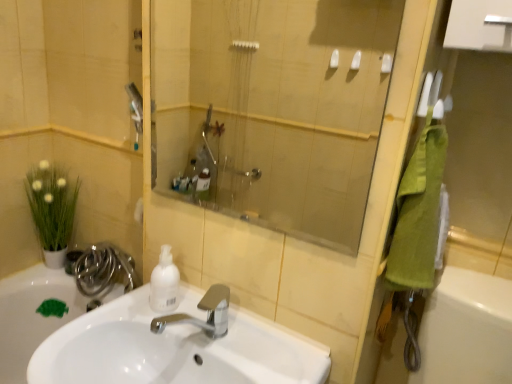
Question: Does transparent glass shower at center have a smaller size compared to white matte bottle at center?

Choices:
 (A) no
 (B) yes

Answer: (A)

Question: Does transparent glass shower at center have a greater width compared to white matte bottle at center?

Choices:
 (A) yes
 (B) no

Answer: (B)

Question: Does transparent glass shower at center come in front of white matte bottle at center?

Choices:
 (A) yes
 (B) no

Answer: (A)

Question: Is transparent glass shower at center looking in the opposite direction of white matte bottle at center?

Choices:
 (A) no
 (B) yes

Answer: (A)

Question: From a real-world perspective, is transparent glass shower at center positioned under white matte bottle at center based on gravity?

Choices:
 (A) no
 (B) yes

Answer: (A)

Question: Could white matte bottle at center be considered to be inside transparent glass shower at center?

Choices:
 (A) no
 (B) yes

Answer: (A)

Question: Considering the relative sizes of transparent glass shower at center and green matte plant at left in the image provided, is transparent glass shower at center wider than green matte plant at left?

Choices:
 (A) no
 (B) yes

Answer: (A)

Question: Is transparent glass shower at center not inside green matte plant at left?

Choices:
 (A) yes
 (B) no

Answer: (A)

Question: Does transparent glass shower at center touch green matte plant at left?

Choices:
 (A) no
 (B) yes

Answer: (A)

Question: Is transparent glass shower at center at the right side of green matte plant at left?

Choices:
 (A) yes
 (B) no

Answer: (A)

Question: From the image's perspective, does transparent glass shower at center appear lower than green matte plant at left?

Choices:
 (A) no
 (B) yes

Answer: (A)

Question: Is transparent glass shower at center positioned with its back to green matte plant at left?

Choices:
 (A) no
 (B) yes

Answer: (A)

Question: Considering the relative sizes of white glossy sink at center and green towel at right in the image provided, is white glossy sink at center smaller than green towel at right?

Choices:
 (A) no
 (B) yes

Answer: (A)